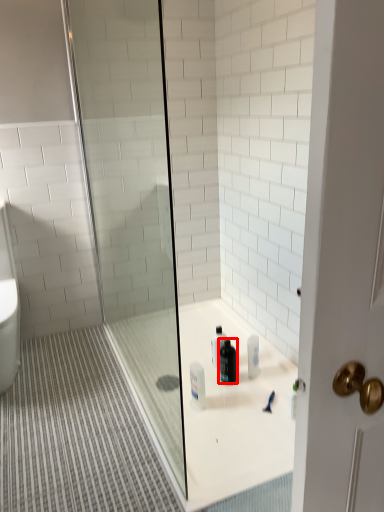
Question: From the image's perspective, considering the relative positions of cleaning product (annotated by the red box) and shower door in the image provided, where is cleaning product (annotated by the red box) located with respect to the staircase?

Choices:
 (A) below
 (B) above

Answer: (A)